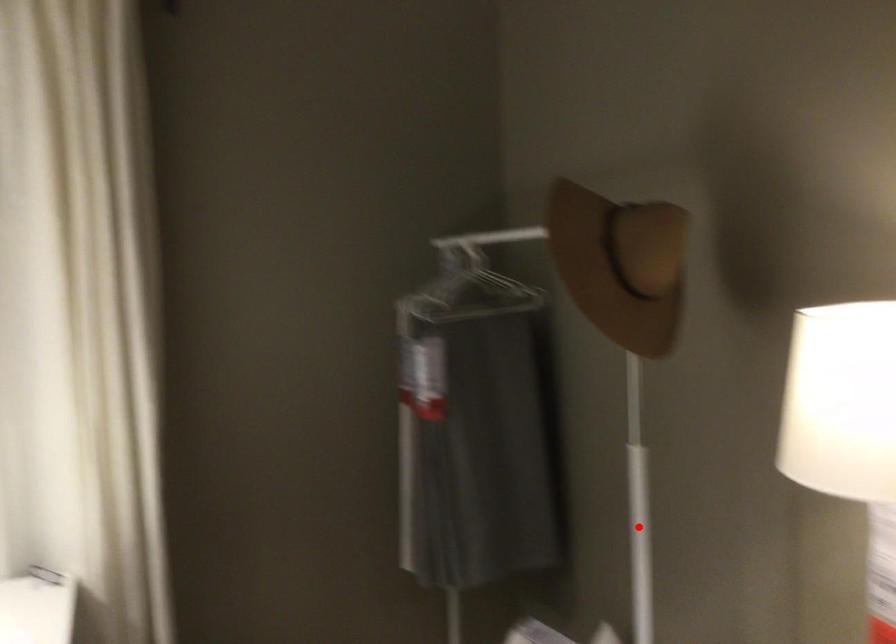
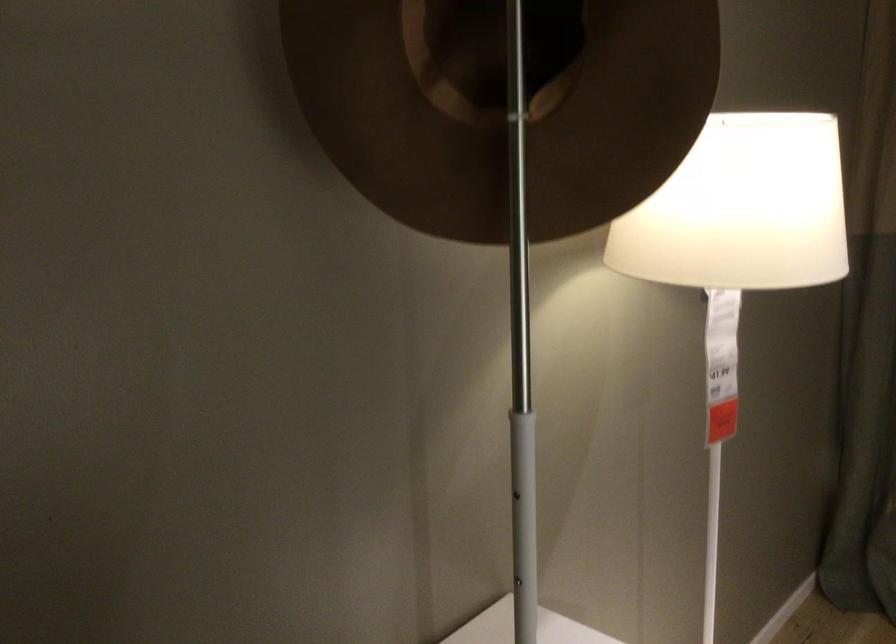
In the second image, find the point that corresponds to the highlighted location in the first image.

(522, 553)